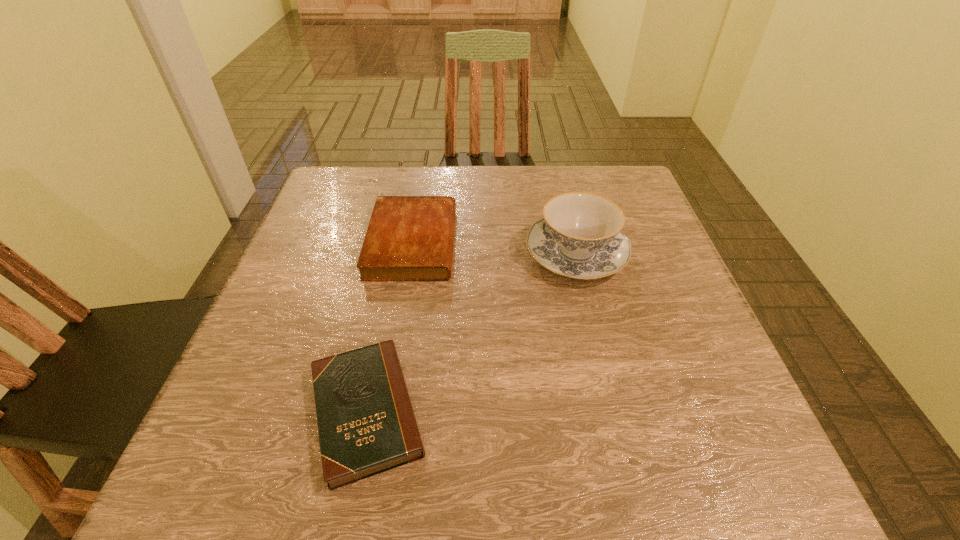
Image resolution: width=960 pixels, height=540 pixels. I want to click on free space between the farther Bible and the nearer Bible, so click(390, 327).

Identify the location of vacant space that is in between the tallest object and the taller Bible. (494, 248).

The width and height of the screenshot is (960, 540). I want to click on empty space between the rightmost object and the taller Bible, so click(494, 248).

Identify which object is the nearest to the taller Bible. Please provide its 2D coordinates. Your answer should be formatted as a tuple, i.e. [(x, y)], where the tuple contains the x and y coordinates of a point satisfying the conditions above.

[(580, 236)]

Where is `object that stands as the closest to the rightmost object`? The width and height of the screenshot is (960, 540). object that stands as the closest to the rightmost object is located at coordinates (409, 238).

Find the location of a particular element. The width and height of the screenshot is (960, 540). free space that satisfies the following two spatial constraints: 1. on the spine side of the taller Bible; 2. with the handle on the side of the chinaware is located at coordinates (411, 253).

The height and width of the screenshot is (540, 960). What are the coordinates of `blank space that satisfies the following two spatial constraints: 1. with the handle on the side of the rightmost object; 2. on the spine side of the farther Bible` in the screenshot? It's located at (573, 243).

The image size is (960, 540). I want to click on vacant space that satisfies the following two spatial constraints: 1. on the spine side of the farther Bible; 2. with the handle on the side of the chinaware, so click(411, 253).

Image resolution: width=960 pixels, height=540 pixels. I want to click on free space that satisfies the following two spatial constraints: 1. on the spine side of the second shortest object; 2. with the handle on the side of the rightmost object, so click(x=411, y=253).

The width and height of the screenshot is (960, 540). I want to click on free space that satisfies the following two spatial constraints: 1. with the handle on the side of the rightmost object; 2. on the spine side of the farther Bible, so click(573, 243).